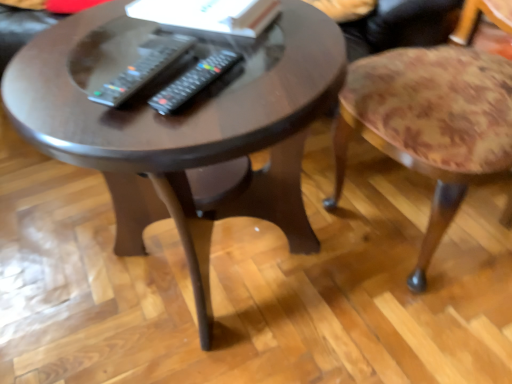
Find the location of `vacant space underneath floral fabric stool at right (from a real-world perspective)`. vacant space underneath floral fabric stool at right (from a real-world perspective) is located at coordinates (410, 219).